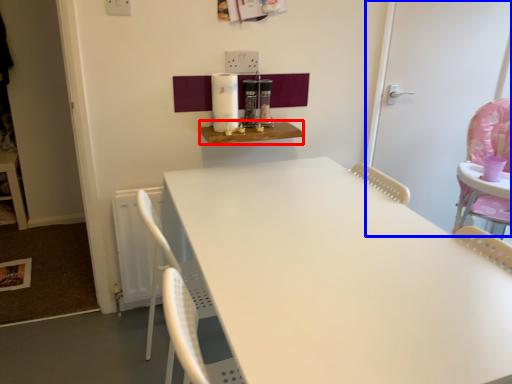
Question: Among these objects, which one is farthest to the camera, table (highlighted by a red box) or door (highlighted by a blue box)?

Choices:
 (A) table
 (B) door

Answer: (B)